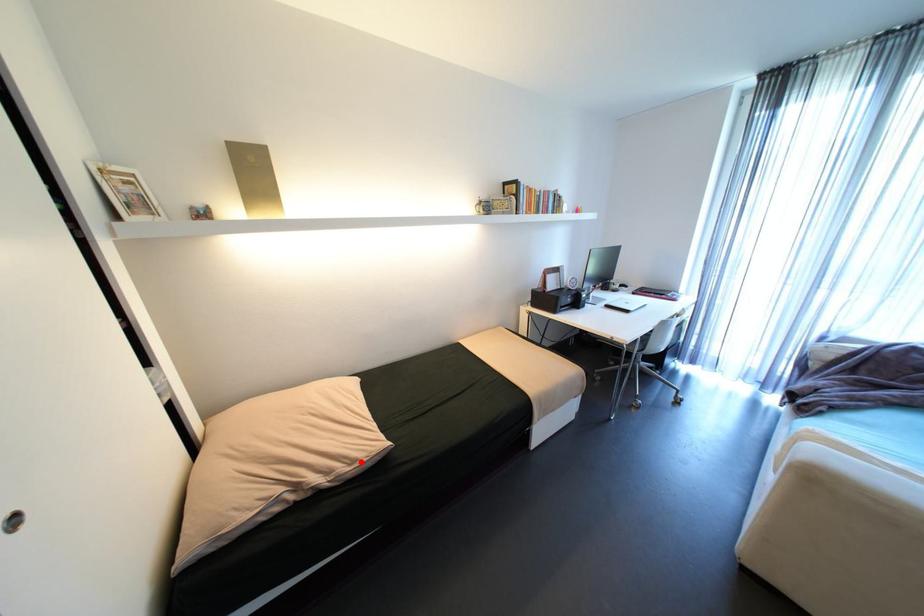
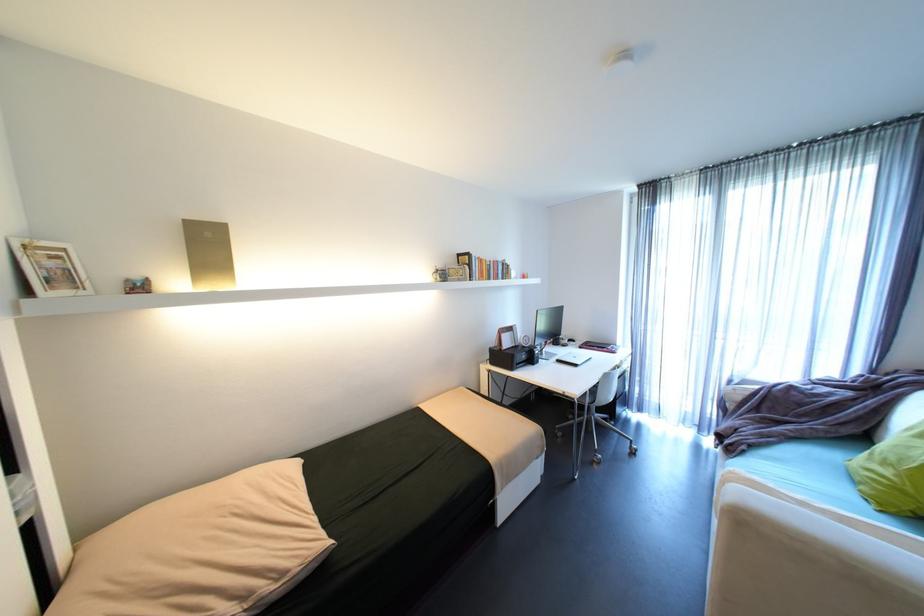
Locate, in the second image, the point that corresponds to the highlighted location in the first image.

(289, 575)